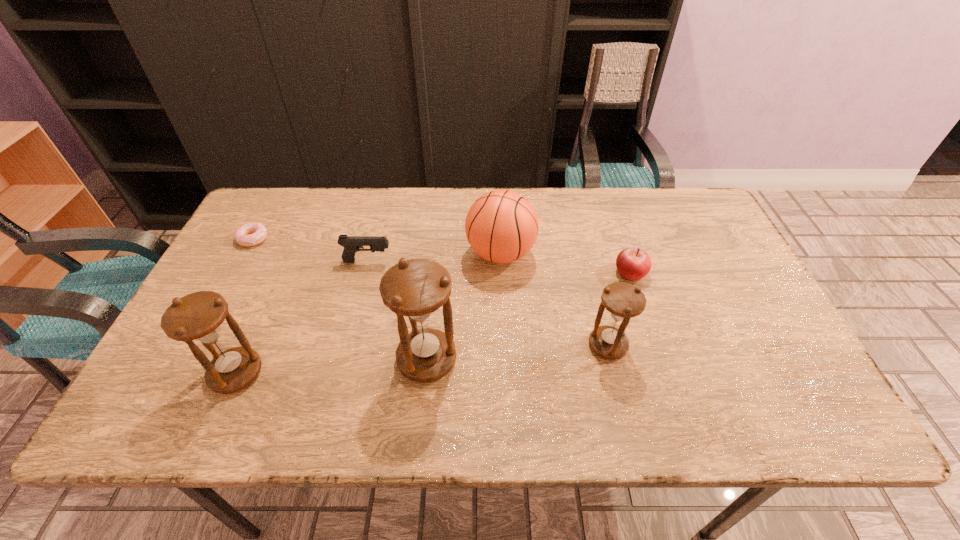
Where is `the fifth object from left to right`? the fifth object from left to right is located at coordinates (501, 226).

Identify the location of free space located 0.180m on the back of the leftmost hourglass. This screenshot has height=540, width=960. (271, 294).

The height and width of the screenshot is (540, 960). Find the location of `free space located 0.070m on the back of the second hourglass from right to left`. free space located 0.070m on the back of the second hourglass from right to left is located at coordinates (431, 312).

Where is `vacant region located 0.070m on the back of the shortest hourglass`? vacant region located 0.070m on the back of the shortest hourglass is located at coordinates (599, 308).

This screenshot has height=540, width=960. Identify the location of vacant position located on the front of the shortest object. (228, 286).

Where is `free region located on the front of the apple`? Image resolution: width=960 pixels, height=540 pixels. free region located on the front of the apple is located at coordinates (x=660, y=361).

The height and width of the screenshot is (540, 960). Find the location of `free spot located at the barrel of the pistol`. free spot located at the barrel of the pistol is located at coordinates (519, 261).

Locate an element on the screen. Image resolution: width=960 pixels, height=540 pixels. vacant space located on the right of the basketball is located at coordinates (598, 254).

Image resolution: width=960 pixels, height=540 pixels. What are the coordinates of `doughnut that is at the far edge` in the screenshot? It's located at (250, 234).

This screenshot has height=540, width=960. In order to click on basketball at the far edge in this screenshot , I will do `click(501, 226)`.